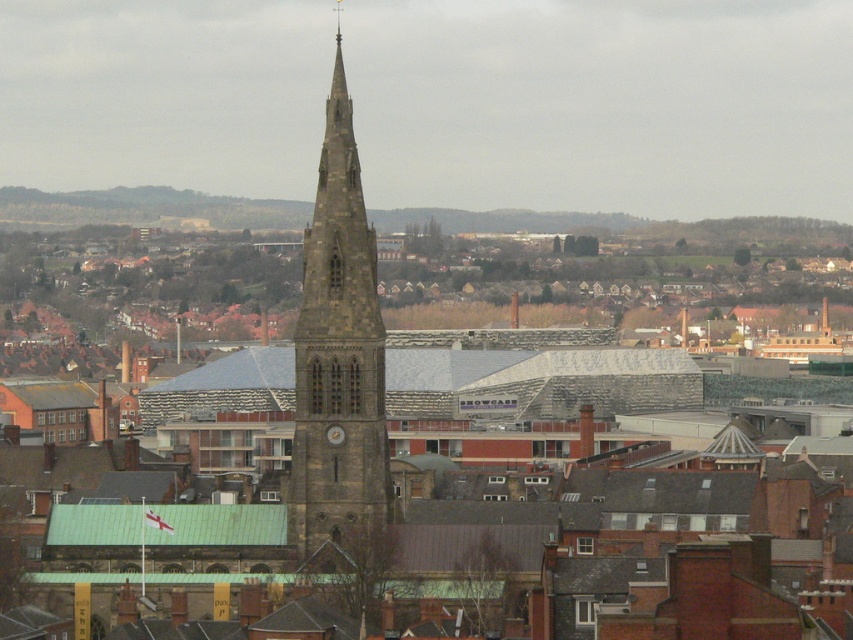
You are an architect analyzing the cityscape. You see the dark gray stone church steeple at center and the dark gray stone tower at center. Which structure is taller?

The dark gray stone tower at center is taller than the dark gray stone church steeple at center.

You are standing in the city and see the point marked at coordinates (x=538, y=376). Based on the scene description, what structure is this point located on?

The point marked at coordinates (x=538, y=376) is located on the dark gray stone church steeple at center.

You are an architect analyzing the cityscape. You notice the dark gray stone church steeple at center and the dark gray stone tower at center. Which one is positioned to the left?

The dark gray stone church steeple at center is positioned to the left of the dark gray stone tower at center.